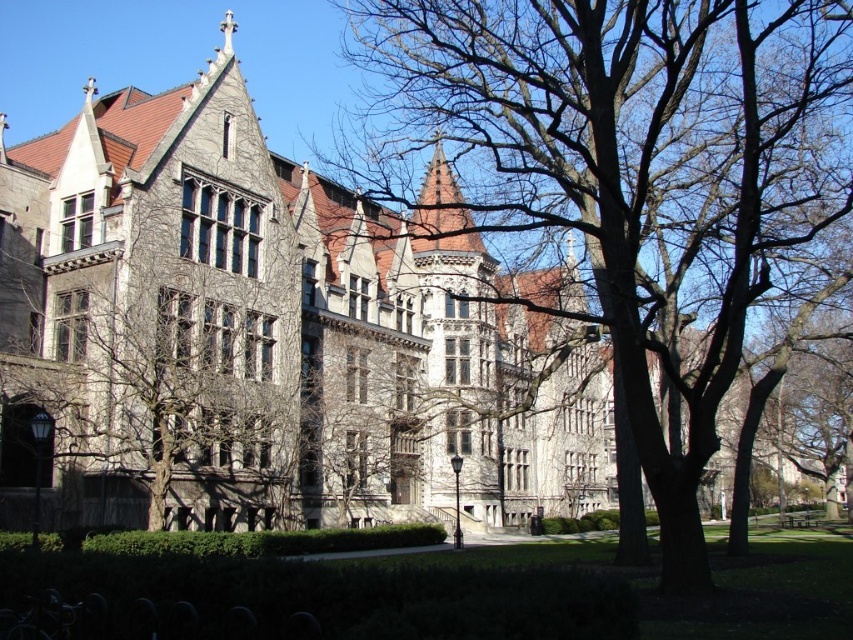
Between brown bark tree at center and gray stone tree at center, which one has less height?

Standing shorter between the two is gray stone tree at center.

Between brown bark tree at center and gray stone tree at center, which one is positioned higher?

brown bark tree at center is above.

Measure the distance between point [466,17] and camera.

They are 58.03 meters apart.

Image resolution: width=853 pixels, height=640 pixels. I want to click on brown bark tree at center, so click(624, 172).